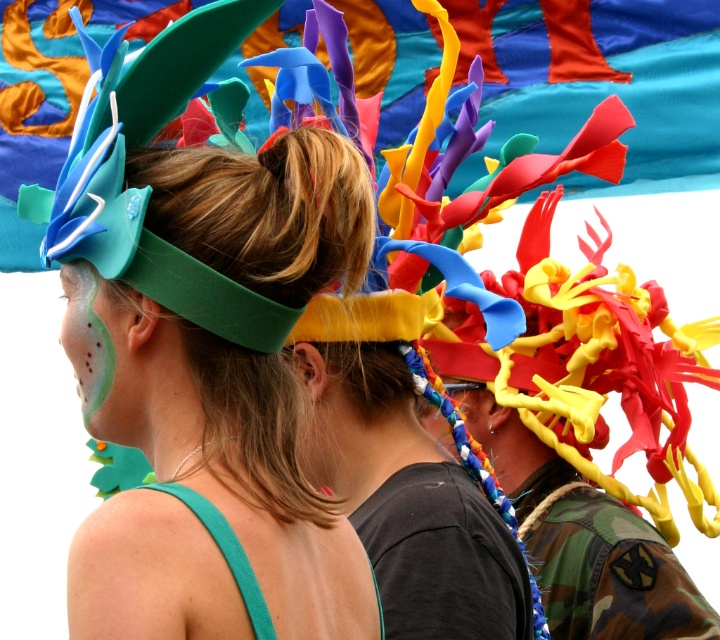
Does matte green headband at center have a greater height compared to brown hair at center?

Yes, matte green headband at center is taller than brown hair at center.

Which is in front, point (282, 532) or point (282, 497)?

Point (282, 532)

Who is more forward, (301, 524) or (294, 416)?

Positioned in front is point (301, 524).

Find the location of a particular element. matte green headband at center is located at coordinates (217, 444).

Between brown hair at center and green matte face paint at center, which one appears on the right side from the viewer's perspective?

From the viewer's perspective, brown hair at center appears more on the right side.

Is brown hair at center behind green matte face paint at center?

No, brown hair at center is closer to the viewer.

Between point (207, 419) and point (84, 317), which one is positioned behind?

Point (84, 317)

This screenshot has width=720, height=640. I want to click on brown hair at center, so click(x=252, y=426).

Can you confirm if matte green headband at center is smaller than green matte face paint at center?

No, matte green headband at center is not smaller than green matte face paint at center.

Is matte green headband at center to the right of green matte face paint at center from the viewer's perspective?

Correct, you'll find matte green headband at center to the right of green matte face paint at center.

What do you see at coordinates (217, 444) in the screenshot? The width and height of the screenshot is (720, 640). I see `matte green headband at center` at bounding box center [217, 444].

This screenshot has width=720, height=640. What are the coordinates of `matte green headband at center` in the screenshot? It's located at (217, 444).